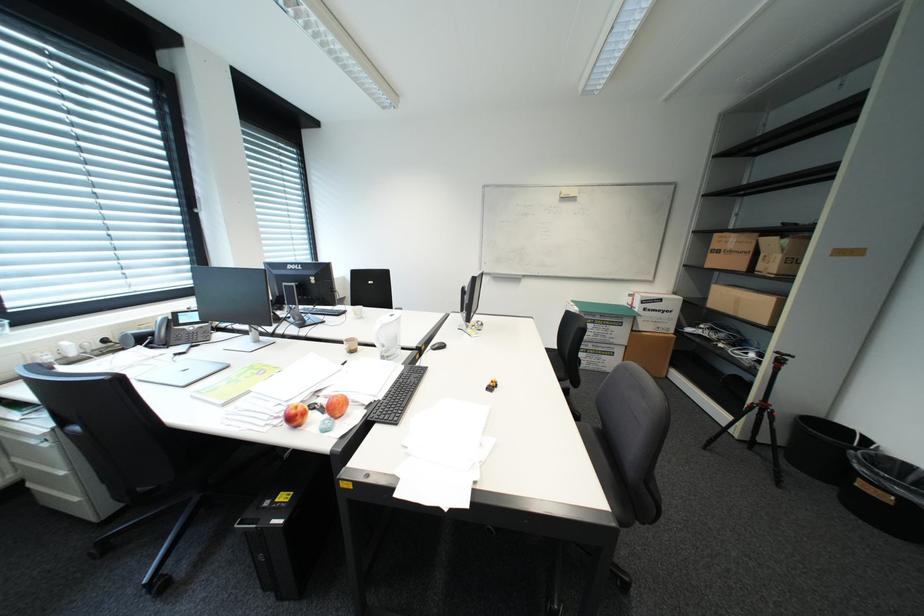
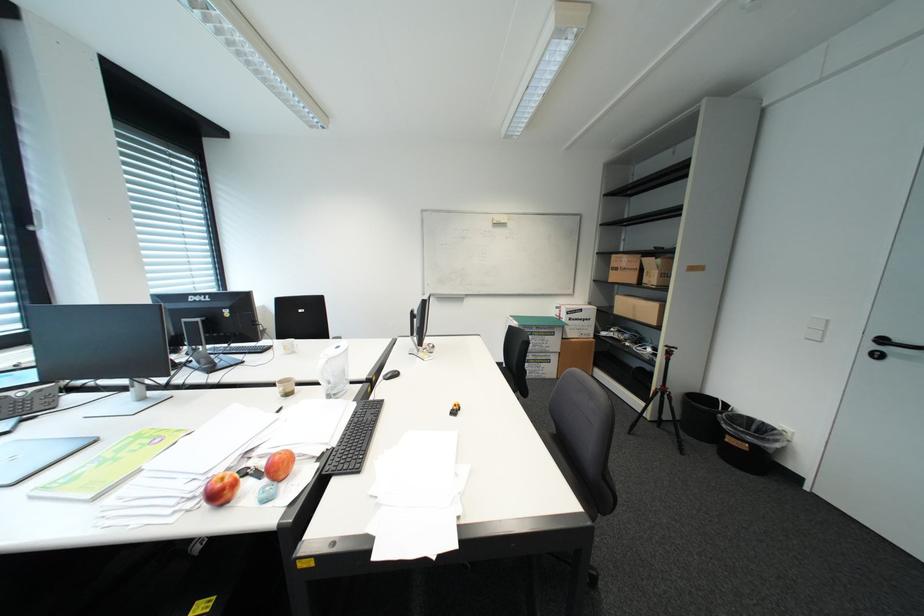
Question: In a continuous first-person perspective shot, in which direction is the camera moving?

Choices:
 (A) Left
 (B) Right
 (C) Forward
 (D) Backward

Answer: (A)